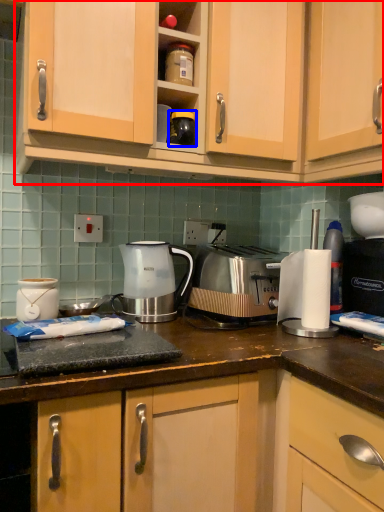
Question: Which object is further to the camera taking this photo, cabinetry (highlighted by a red box) or appliance (highlighted by a blue box)?

Choices:
 (A) cabinetry
 (B) appliance

Answer: (B)